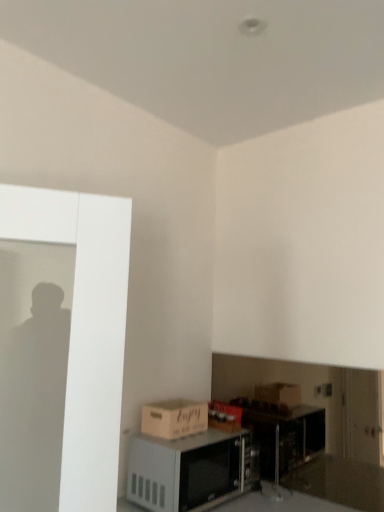
Question: From the image's perspective, is white matte microwave at lower center positioned above or below matte brown cardboard box at lower left?

Choices:
 (A) above
 (B) below

Answer: (B)

Question: Is point (157, 506) positioned closer to the camera than point (162, 404)?

Choices:
 (A) farther
 (B) closer

Answer: (B)

Question: Is white matte microwave at lower center in front of or behind matte brown cardboard box at lower left in the image?

Choices:
 (A) front
 (B) behind

Answer: (A)

Question: Considering the positions of matte brown cardboard box at lower left and white matte microwave at lower center in the image, is matte brown cardboard box at lower left taller or shorter than white matte microwave at lower center?

Choices:
 (A) short
 (B) tall

Answer: (A)

Question: Considering the positions of point (165, 422) and point (182, 457), is point (165, 422) closer or farther from the camera than point (182, 457)?

Choices:
 (A) closer
 (B) farther

Answer: (A)

Question: From a real-world perspective, is matte brown cardboard box at lower left physically located above or below white matte microwave at lower center?

Choices:
 (A) above
 (B) below

Answer: (A)

Question: Looking at their shapes, would you say matte brown cardboard box at lower left is wider or thinner than white matte microwave at lower center?

Choices:
 (A) wide
 (B) thin

Answer: (B)